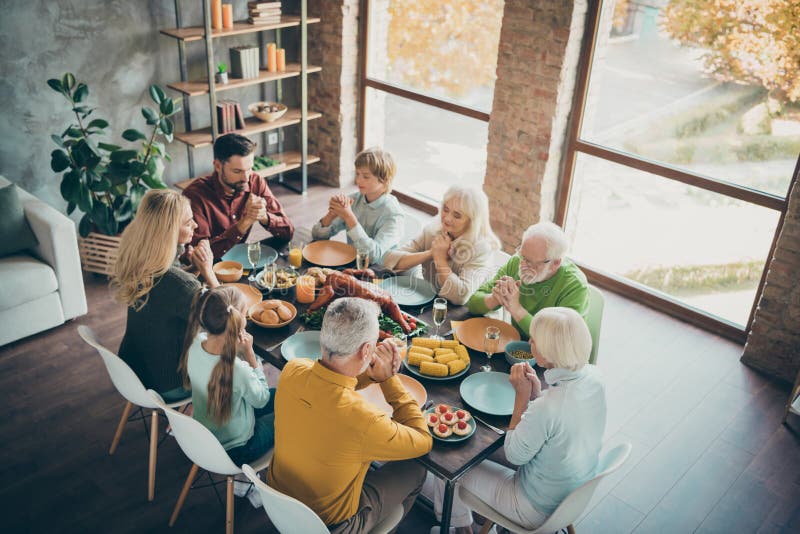
Where is `metal chair legs`? metal chair legs is located at coordinates (116, 439), (145, 457), (178, 490), (224, 506), (566, 525).